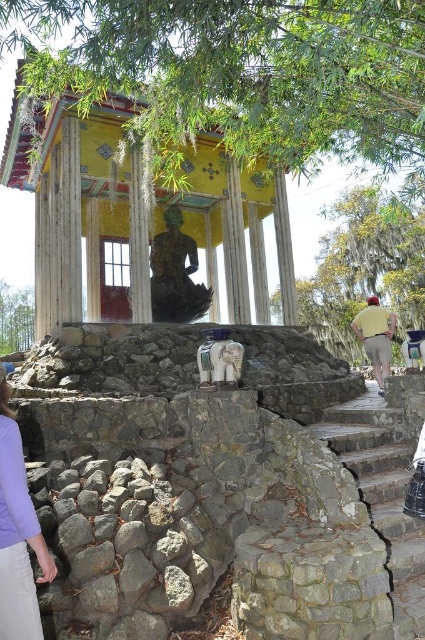
Is yellow painted wood gazebo at center below greenish-yellow painted statue at center?

Incorrect, yellow painted wood gazebo at center is not positioned below greenish-yellow painted statue at center.

Does yellow painted wood gazebo at center have a smaller size compared to greenish-yellow painted statue at center?

Indeed, yellow painted wood gazebo at center has a smaller size compared to greenish-yellow painted statue at center.

This screenshot has height=640, width=425. Find the location of `yellow painted wood gazebo at center`. yellow painted wood gazebo at center is located at coordinates (138, 218).

What are the coordinates of `yellow painted wood gazebo at center` in the screenshot? It's located at (138, 218).

What do you see at coordinates (138, 218) in the screenshot?
I see `yellow painted wood gazebo at center` at bounding box center [138, 218].

Does yellow painted wood gazebo at center appear under light purple fabric at lower left?

Actually, yellow painted wood gazebo at center is above light purple fabric at lower left.

Between point (68, 193) and point (48, 561), which one is positioned in front?

Point (48, 561) is in front.

Locate an element on the screen. This screenshot has width=425, height=640. yellow painted wood gazebo at center is located at coordinates (138, 218).

Does point (178, 264) lie in front of point (360, 333)?

That is False.

Who is lower down, greenish-yellow painted statue at center or yellow cotton shirt at right?

yellow cotton shirt at right is lower down.

This screenshot has height=640, width=425. In order to click on greenish-yellow painted statue at center in this screenshot , I will do `click(175, 273)`.